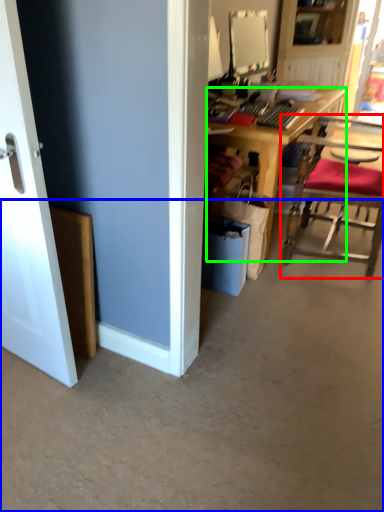
Question: Which object is the farthest from chair (highlighted by a red box)? Choose among these: concrete (highlighted by a blue box) or desk (highlighted by a green box).

Choices:
 (A) concrete
 (B) desk

Answer: (A)